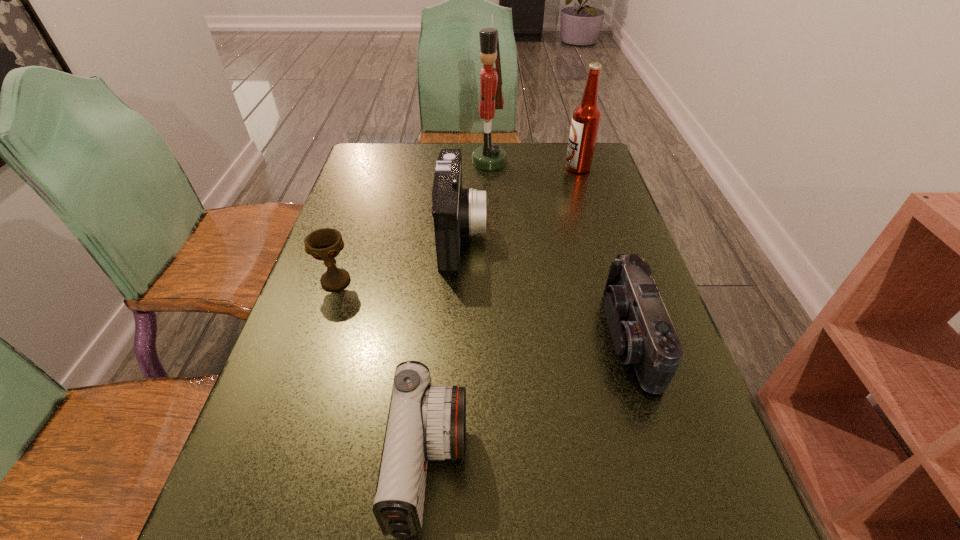
Locate an element on the screen. Image resolution: width=960 pixels, height=540 pixels. free space located on the label side of the alcohol is located at coordinates (486, 167).

You are a GUI agent. You are given a task and a screenshot of the screen. Output one action in this format:
    pyautogui.click(x=<x>, y=<y>)
    Task: Click on the free space located on the label side of the alcohol
    This screenshot has width=960, height=540.
    Given the screenshot: What is the action you would take?
    pyautogui.click(x=498, y=167)

Locate an element on the screen. This screenshot has width=960, height=540. vacant space located on the lens of the tallest camcorder is located at coordinates (528, 234).

Where is `free location located on the front-facing side of the rightmost camcorder`? This screenshot has width=960, height=540. free location located on the front-facing side of the rightmost camcorder is located at coordinates (459, 338).

Identify the location of free region located on the front-facing side of the rightmost camcorder. (449, 338).

This screenshot has height=540, width=960. What are the coordinates of `free space located on the front-facing side of the rightmost camcorder` in the screenshot? It's located at (566, 338).

This screenshot has height=540, width=960. What are the coordinates of `vacant area located 0.150m on the back of the leftmost object` in the screenshot? It's located at (353, 230).

Where is `nutcracker that is at the far edge`? The image size is (960, 540). nutcracker that is at the far edge is located at coordinates (490, 156).

I want to click on alcohol at the far edge, so (586, 118).

Find the location of a particular element. The width and height of the screenshot is (960, 540). object that is positioned at the left edge is located at coordinates (324, 244).